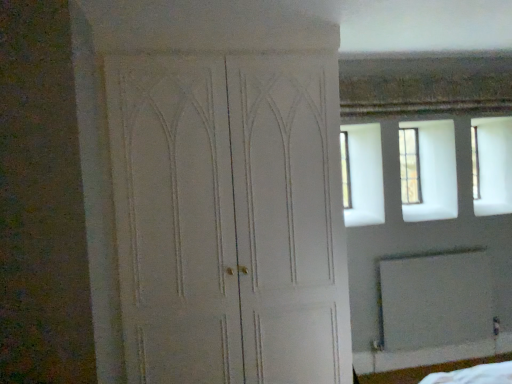
What do you see at coordinates (409, 166) in the screenshot?
I see `clear glass window at upper right` at bounding box center [409, 166].

The width and height of the screenshot is (512, 384). In order to click on white matte screen door at lower right in this screenshot , I will do `click(435, 300)`.

The width and height of the screenshot is (512, 384). In order to click on clear glass window at upper right in this screenshot , I will do `click(409, 166)`.

Is clear glass window at upper right aimed at white matte door at center?

No, clear glass window at upper right is not turned towards white matte door at center.

Considering the sizes of objects clear glass window at upper right and white matte door at center in the image provided, who is taller, clear glass window at upper right or white matte door at center?

white matte door at center is taller.

Looking at this image, are clear glass window at upper right and white matte door at center beside each other?

No.

Which point is more distant from viewer, (434, 283) or (405, 152)?

Positioned behind is point (405, 152).

Is the surface of white matte screen door at lower right in direct contact with clear glass window at upper right?

No.

Does white matte screen door at lower right come in front of clear glass window at upper right?

That is True.

Who is smaller, white matte screen door at lower right or clear glass window at upper right?

clear glass window at upper right is smaller.

Is clear glass window at upper right oriented away from white matte screen door at lower right?

No.

From the image's perspective, is clear glass window at upper right above white matte screen door at lower right?

Indeed, from the image's perspective, clear glass window at upper right is shown above white matte screen door at lower right.

Does point (409, 150) come closer to viewer compared to point (426, 266)?

That is False.

Considering the relative positions of clear glass window at upper right and white matte screen door at lower right in the image provided, is clear glass window at upper right to the right of white matte screen door at lower right from the viewer's perspective?

In fact, clear glass window at upper right is to the left of white matte screen door at lower right.

Find the location of a particular element. door above the white matte screen door at lower right (from a real-world perspective) is located at coordinates (230, 219).

Looking at their sizes, would you say white matte door at center is wider or thinner than white matte screen door at lower right?

Clearly, white matte door at center has more width compared to white matte screen door at lower right.

Which object is further away from the camera, white matte door at center or white matte screen door at lower right?

white matte screen door at lower right is more distant.

From the image's perspective, relative to white matte screen door at lower right, is white matte door at center above or below?

From the image's perspective, white matte door at center appears above white matte screen door at lower right.

Considering the positions of objects white matte screen door at lower right and white matte door at center in the image provided, who is more to the right, white matte screen door at lower right or white matte door at center?

white matte screen door at lower right is more to the right.

Consider the image. Is white matte screen door at lower right bigger than white matte door at center?

No, white matte screen door at lower right is not bigger than white matte door at center.

Locate an element on the screen. The height and width of the screenshot is (384, 512). door above the white matte screen door at lower right (from a real-world perspective) is located at coordinates (230, 219).

Is white matte screen door at lower right in front of or behind white matte door at center in the image?

white matte screen door at lower right is positioned farther from the viewer than white matte door at center.

Which is in front, point (250, 380) or point (412, 136)?

Point (250, 380)

Do you think white matte door at center is within clear glass window at upper right, or outside of it?

white matte door at center is outside clear glass window at upper right.

Between white matte door at center and clear glass window at upper right, which one has less height?

With less height is clear glass window at upper right.

Is white matte door at center bigger or smaller than clear glass window at upper right?

In the image, white matte door at center appears to be larger than clear glass window at upper right.

The image size is (512, 384). In order to click on door beneath the clear glass window at upper right (from a real-world perspective) in this screenshot , I will do `click(230, 219)`.

Find the location of a particular element. The width and height of the screenshot is (512, 384). window behind the white matte screen door at lower right is located at coordinates pyautogui.click(x=409, y=166).

In the scene shown: Which object lies nearer to the anchor point clear glass window at upper right, white matte door at center or white matte screen door at lower right?

Among the two, white matte screen door at lower right is located nearer to clear glass window at upper right.

Estimate the real-world distances between objects in this image. Which object is closer to white matte door at center, white matte screen door at lower right or clear glass window at upper right?

The object closer to white matte door at center is white matte screen door at lower right.

Considering their positions, is clear glass window at upper right positioned further to white matte door at center than white matte screen door at lower right?

The object further to white matte door at center is clear glass window at upper right.

Based on their spatial positions, is clear glass window at upper right or white matte door at center further from white matte screen door at lower right?

Based on the image, white matte door at center appears to be further to white matte screen door at lower right.

When comparing their distances from white matte screen door at lower right, does white matte door at center or clear glass window at upper right seem further?

The object further to white matte screen door at lower right is white matte door at center.

From the picture: Which object lies nearer to the anchor point clear glass window at upper right, white matte screen door at lower right or white matte door at center?

Among the two, white matte screen door at lower right is located nearer to clear glass window at upper right.

You are a GUI agent. You are given a task and a screenshot of the screen. Output one action in this format:
    pyautogui.click(x=<x>, y=<y>)
    Task: Click on the window between white matte door at center and white matte screen door at lower right in the horizontal direction
    
    Given the screenshot: What is the action you would take?
    pyautogui.click(x=409, y=166)